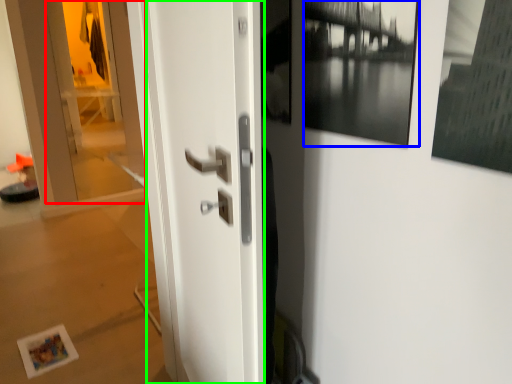
Question: Estimate the real-world distances between objects in this image. Which object is farther from glass door (highlighted by a red box), picture frame (highlighted by a blue box) or door (highlighted by a green box)?

Choices:
 (A) picture frame
 (B) door

Answer: (A)